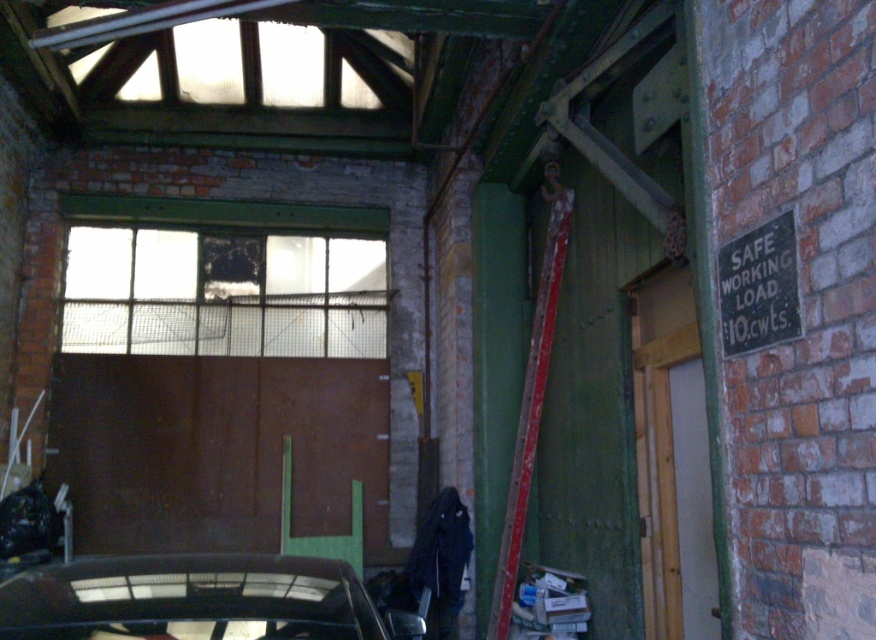
Question: Is rusty metal garage door at center thinner than rusty metal ladder at center?

Choices:
 (A) no
 (B) yes

Answer: (A)

Question: Which object is farther from the camera taking this photo?

Choices:
 (A) shiny black car at lower left
 (B) rusty metal garage door at center
 (C) rusty metal ladder at center

Answer: (B)

Question: Is shiny black car at lower left positioned at the back of rusty metal ladder at center?

Choices:
 (A) no
 (B) yes

Answer: (A)

Question: Which of the following is the closest to the observer?

Choices:
 (A) shiny black car at lower left
 (B) rusty metal garage door at center

Answer: (A)

Question: Is rusty metal garage door at center wider than shiny black car at lower left?

Choices:
 (A) yes
 (B) no

Answer: (A)

Question: Which object appears closest to the camera in this image?

Choices:
 (A) rusty metal ladder at center
 (B) shiny black car at lower left

Answer: (B)